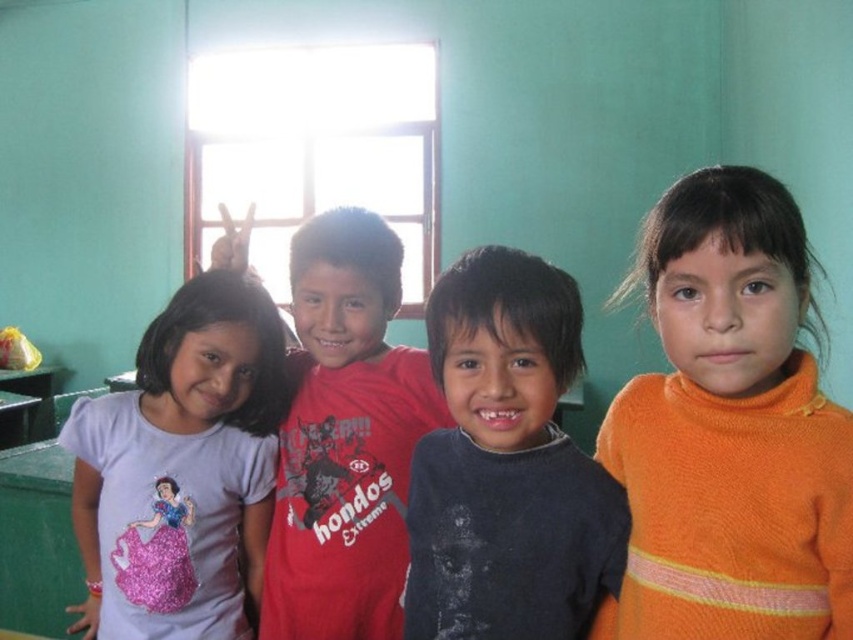
Does point (570, 593) lie behind point (144, 368)?

No, it is in front of (144, 368).

Who is more distant from viewer, [454,403] or [245,634]?

The point [245,634] is behind.

You are a GUI agent. You are given a task and a screenshot of the screen. Output one action in this format:
    pyautogui.click(x=<x>, y=<y>)
    Task: Click on the dark gray sweater at center
    
    Given the screenshot: What is the action you would take?
    pyautogui.click(x=508, y=465)

The width and height of the screenshot is (853, 640). What do you see at coordinates (729, 429) in the screenshot? I see `orange knitted sweater at right` at bounding box center [729, 429].

Which is above, orange knitted sweater at right or red matte shirt at center?

Positioned higher is red matte shirt at center.

Where is `orange knitted sweater at right`? This screenshot has width=853, height=640. orange knitted sweater at right is located at coordinates (729, 429).

Which is below, purple cotton shirt at left or red matte shirt at center?

Positioned lower is purple cotton shirt at left.

Is purple cotton shirt at left positioned at the back of red matte shirt at center?

Yes, purple cotton shirt at left is behind red matte shirt at center.

Where is `purple cotton shirt at left`? This screenshot has width=853, height=640. purple cotton shirt at left is located at coordinates (181, 467).